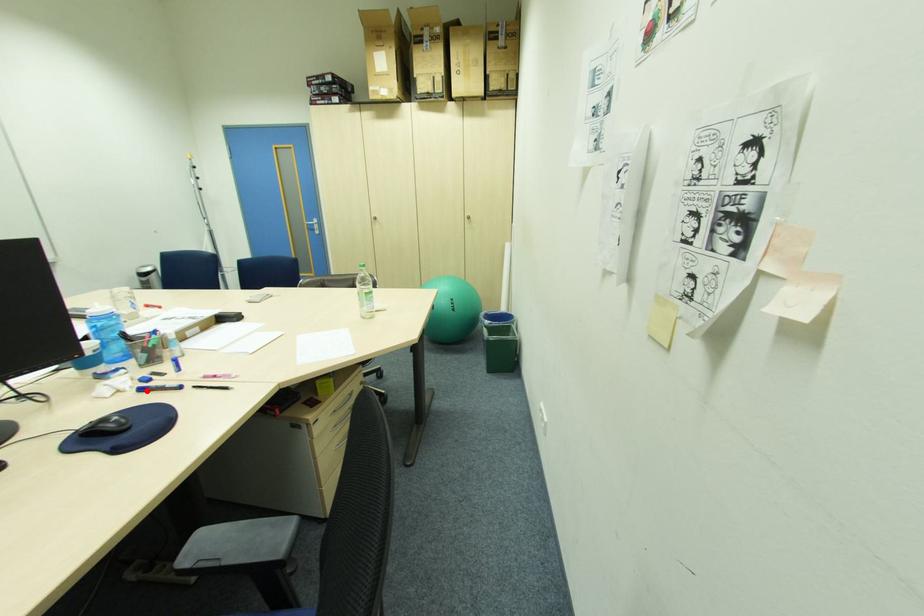
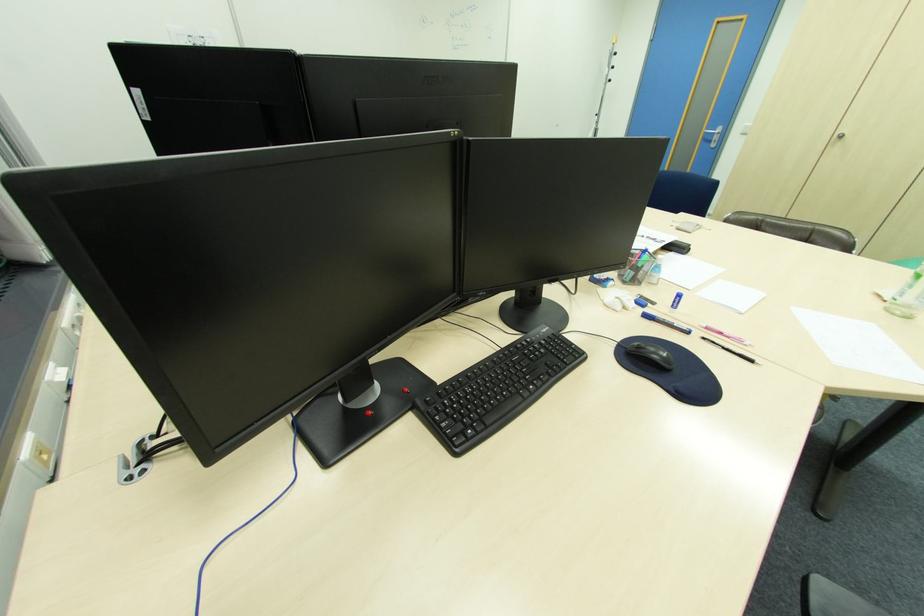
Where in the second image is the point corresponding to the highlighted location from the first image?

(651, 315)